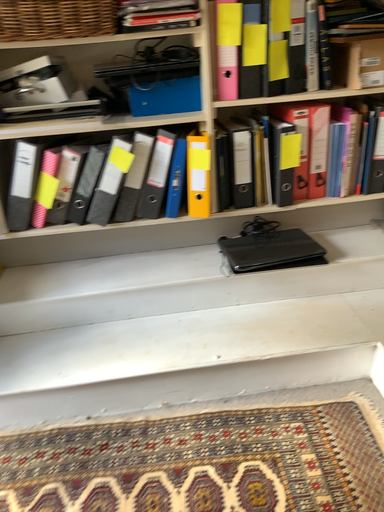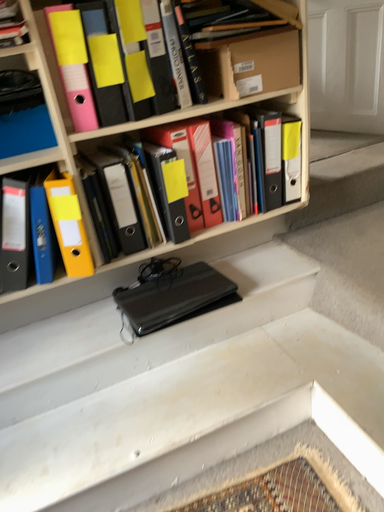
Question: How did the camera likely rotate when shooting the video?

Choices:
 (A) rotated right
 (B) rotated left

Answer: (A)